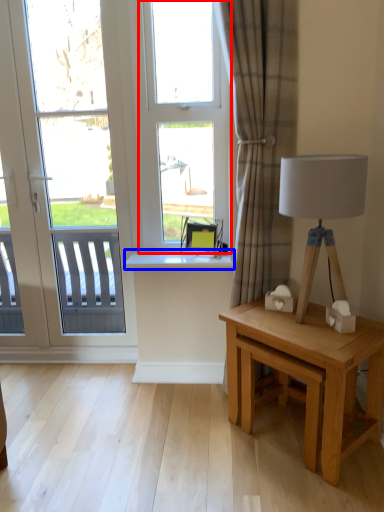
Question: Which object is further to the camera taking this photo, bay window (highlighted by a red box) or window sill (highlighted by a blue box)?

Choices:
 (A) bay window
 (B) window sill

Answer: (B)